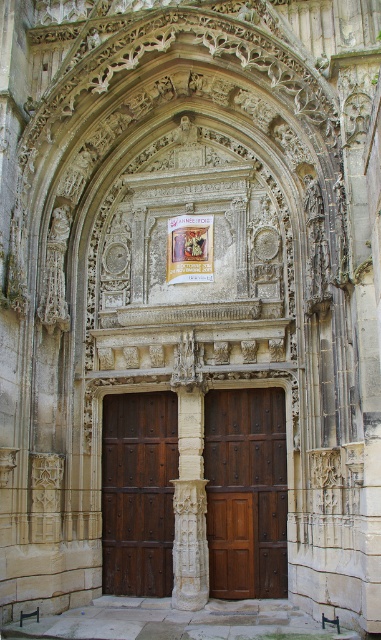
Question: Which object appears farthest from the camera in this image?

Choices:
 (A) white stone column at center
 (B) dark brown wood door at center
 (C) polished wood door at center

Answer: (B)

Question: Can you confirm if polished wood door at center is bigger than white stone column at center?

Choices:
 (A) yes
 (B) no

Answer: (A)

Question: Which of these objects is positioned farthest from the white stone column at center?

Choices:
 (A) dark brown wood door at center
 (B) polished wood door at center

Answer: (A)

Question: From the image, what is the correct spatial relationship of dark brown wood door at center in relation to white stone column at center?

Choices:
 (A) left
 (B) right

Answer: (A)

Question: Can you confirm if polished wood door at center is positioned above white stone column at center?

Choices:
 (A) no
 (B) yes

Answer: (B)

Question: Which point is closer to the camera?

Choices:
 (A) pyautogui.click(x=126, y=584)
 (B) pyautogui.click(x=201, y=524)
 (C) pyautogui.click(x=283, y=548)

Answer: (B)